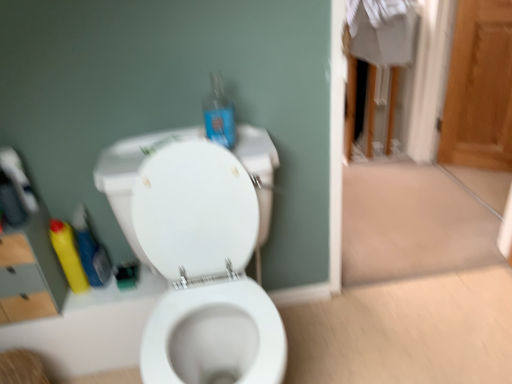
Question: Is the position of yellow plastic bottle at left, which appears as the second cleaning product when viewed from the left, less distant than that of white glossy toilet at center?

Choices:
 (A) no
 (B) yes

Answer: (A)

Question: Can you confirm if yellow plastic bottle at left, which appears as the second cleaning product when viewed from the left, is shorter than white glossy toilet at center?

Choices:
 (A) yes
 (B) no

Answer: (A)

Question: Does yellow plastic bottle at left, the first cleaning product positioned from the right, appear on the left side of white glossy toilet at center?

Choices:
 (A) no
 (B) yes

Answer: (B)

Question: Does yellow plastic bottle at left, which appears as the second cleaning product when viewed from the left, have a greater height compared to white glossy toilet at center?

Choices:
 (A) yes
 (B) no

Answer: (B)

Question: Is yellow plastic bottle at left, which appears as the second cleaning product when viewed from the left, surrounding white glossy toilet at center?

Choices:
 (A) yes
 (B) no

Answer: (B)

Question: Is yellow plastic bottle at left, the first cleaning product positioned from the right, next to white glossy toilet at center and touching it?

Choices:
 (A) yes
 (B) no

Answer: (B)

Question: Is white glossy toilet at center aimed at yellow plastic bottle at left, the first cleaning product positioned from the right?

Choices:
 (A) no
 (B) yes

Answer: (A)

Question: Is white glossy toilet at center shorter than yellow plastic bottle at left, the first cleaning product positioned from the right?

Choices:
 (A) no
 (B) yes

Answer: (A)

Question: From a real-world perspective, is white glossy toilet at center under yellow plastic bottle at left, the first cleaning product positioned from the right?

Choices:
 (A) yes
 (B) no

Answer: (A)

Question: Is white glossy toilet at center further to camera compared to yellow plastic bottle at left, which appears as the second cleaning product when viewed from the left?

Choices:
 (A) yes
 (B) no

Answer: (B)

Question: Does white glossy toilet at center have a lesser width compared to yellow plastic bottle at left, the first cleaning product positioned from the right?

Choices:
 (A) yes
 (B) no

Answer: (B)

Question: Considering the relative positions of white glossy toilet at center and yellow plastic bottle at left, which appears as the second cleaning product when viewed from the left, in the image provided, is white glossy toilet at center in front of yellow plastic bottle at left, which appears as the second cleaning product when viewed from the left,?

Choices:
 (A) no
 (B) yes

Answer: (B)

Question: Is translucent blue plastic bottle at upper center behind matte gray medicine cabinet at left?

Choices:
 (A) yes
 (B) no

Answer: (B)